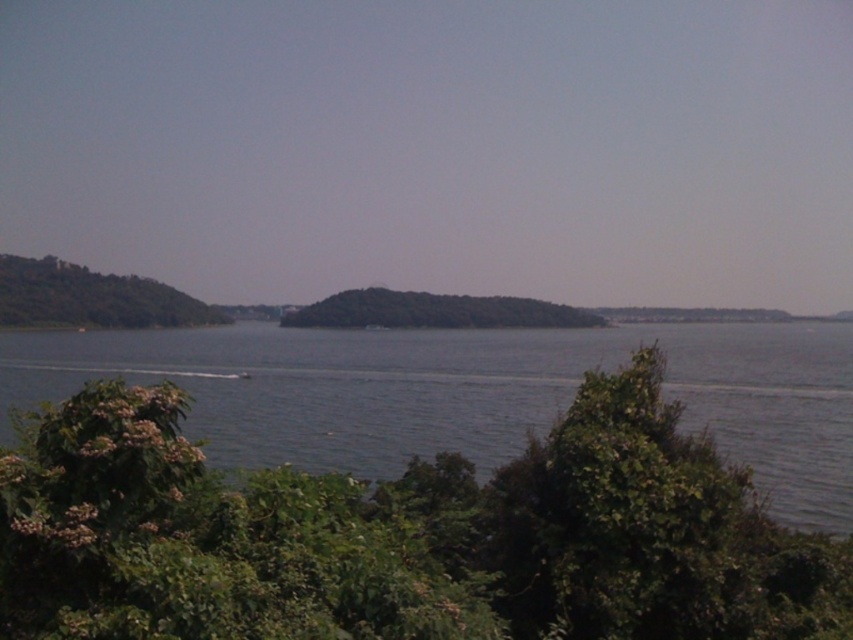
Question: Can you confirm if green leafy bush at lower center is bigger than green leafy hill at center?

Choices:
 (A) yes
 (B) no

Answer: (B)

Question: Estimate the real-world distances between objects in this image. Which object is farther from the green leafy hill at center?

Choices:
 (A) green leafy bush at lower center
 (B) green leafy tree at left

Answer: (A)

Question: Can you confirm if green leafy bush at lower center is smaller than green leafy tree at left?

Choices:
 (A) yes
 (B) no

Answer: (A)

Question: Among these points, which one is nearest to the camera?

Choices:
 (A) (x=225, y=442)
 (B) (x=68, y=296)
 (C) (x=544, y=301)

Answer: (A)

Question: Does green leafy bush at lower center appear over green leafy hill at center?

Choices:
 (A) yes
 (B) no

Answer: (B)

Question: Based on their relative distances, which object is nearer to the green leafy hill at center?

Choices:
 (A) green leafy bush at lower center
 (B) green leafy tree at left

Answer: (B)